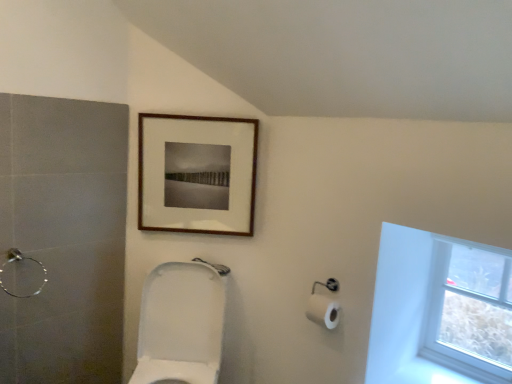
Question: From the image's perspective, is white glossy toilet at center positioned above or below transparent glass window at upper right?

Choices:
 (A) below
 (B) above

Answer: (A)

Question: Does point (172, 329) appear closer or farther from the camera than point (390, 327)?

Choices:
 (A) farther
 (B) closer

Answer: (A)

Question: Which is farther from the transparent glass window at upper right?

Choices:
 (A) white glossy toilet at center
 (B) brushed metal shower at left
 (C) wooden picture frame at upper center

Answer: (B)

Question: Which of these objects is positioned farthest from the transparent glass window at upper right?

Choices:
 (A) white glossy toilet at center
 (B) wooden picture frame at upper center
 (C) brushed metal shower at left

Answer: (C)